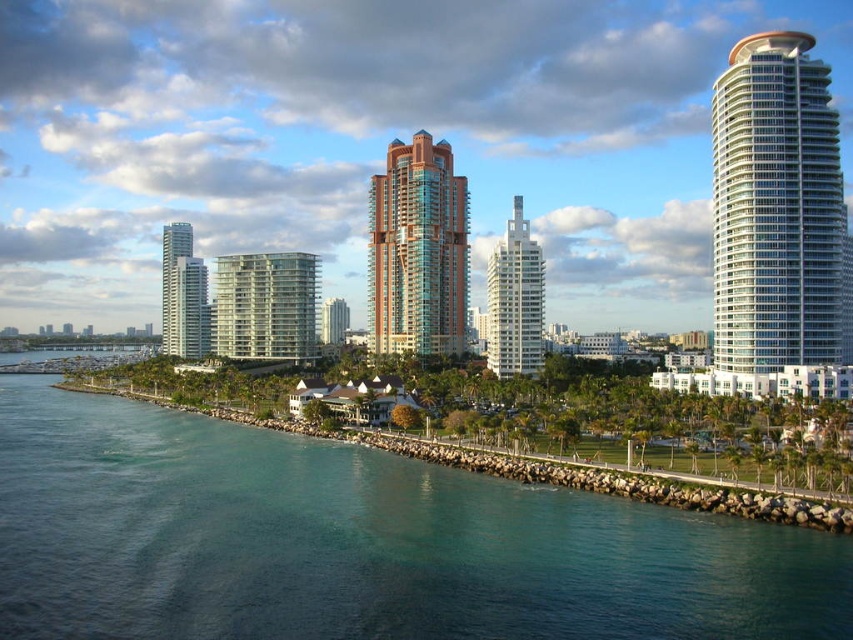
Question: Is teal glass tower at center positioned behind glassy white skyscraper at left?

Choices:
 (A) yes
 (B) no

Answer: (B)

Question: Among these points, which one is nearest to the camera?

Choices:
 (A) (198, 317)
 (B) (526, 280)
 (C) (410, 285)
 (D) (730, 100)

Answer: (D)

Question: Which object appears closest to the camera in this image?

Choices:
 (A) teal glass tower at center
 (B) clear blue water at lower left

Answer: (B)

Question: Is teal glass tower at center further to camera compared to glassy white skyscraper at left?

Choices:
 (A) yes
 (B) no

Answer: (B)

Question: Is white glassy tower at right positioned in front of white glass building at center?

Choices:
 (A) yes
 (B) no

Answer: (A)

Question: Which object is farther from the camera taking this photo?

Choices:
 (A) teal glass tower at center
 (B) clear glass building at center
 (C) white glass building at center

Answer: (B)